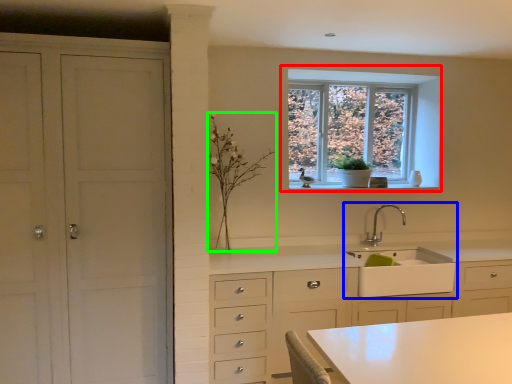
Question: Considering the real-world distances, which object is closest to window (highlighted by a red box)? sink (highlighted by a blue box) or plant (highlighted by a green box).

Choices:
 (A) sink
 (B) plant

Answer: (A)